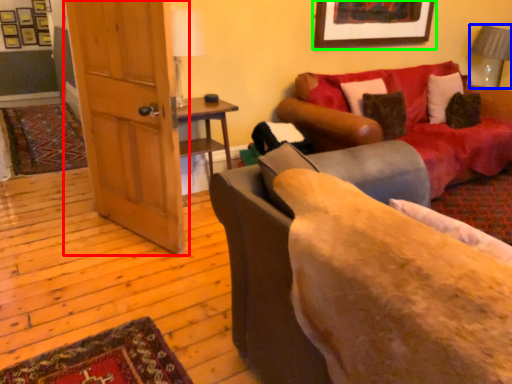
Question: Which object is positioned closest to door (highlighted by a red box)? Select from lamp (highlighted by a blue box) and picture frame (highlighted by a green box).

Choices:
 (A) lamp
 (B) picture frame

Answer: (B)